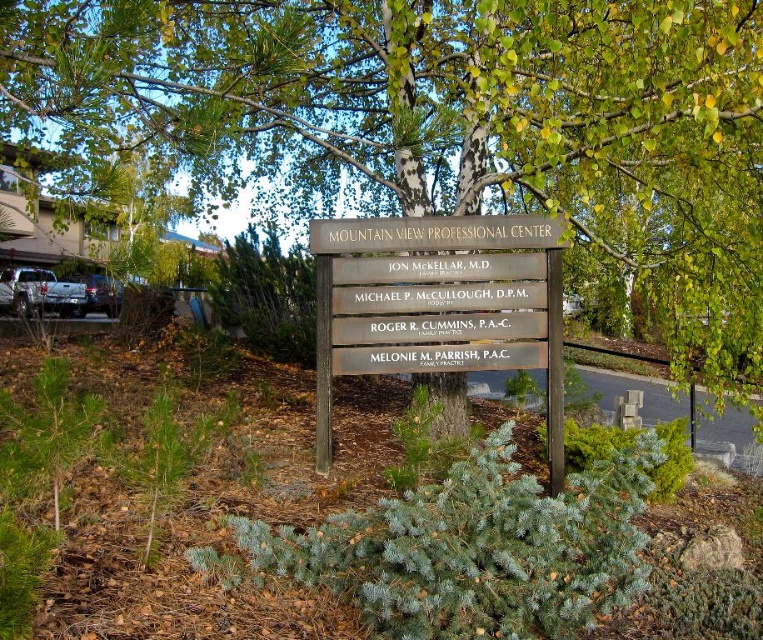
The image size is (763, 640). Describe the element at coordinates (439, 120) in the screenshot. I see `green bark tree at center` at that location.

Where is `green bark tree at center`? Image resolution: width=763 pixels, height=640 pixels. green bark tree at center is located at coordinates (439, 120).

Looking at this image, who is more distant from viewer, [494,102] or [517,237]?

The point [517,237] is more distant.

Where is `green bark tree at center`? green bark tree at center is located at coordinates (439, 120).